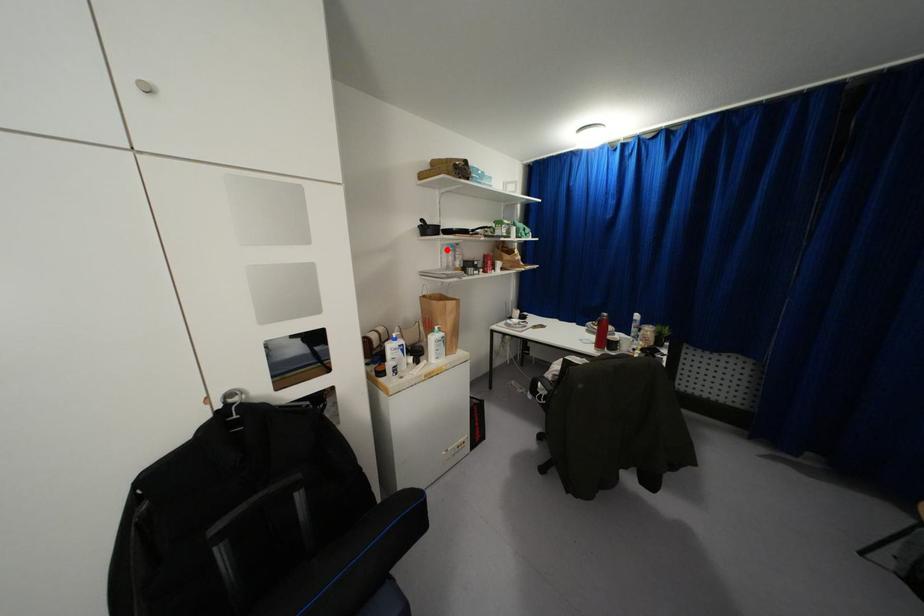
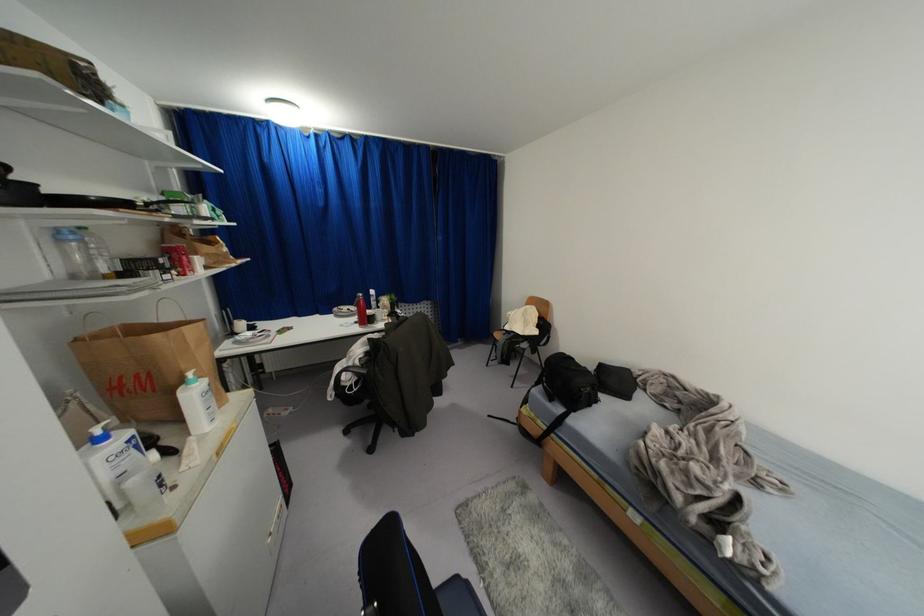
The point at the highlighted location is marked in the first image. Where is the corresponding point in the second image?

(62, 240)